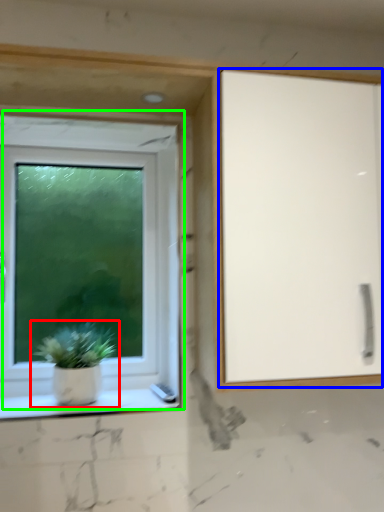
Question: Which is nearer to the houseplant (highlighted by a red box)? screen door (highlighted by a blue box) or window (highlighted by a green box).

Choices:
 (A) screen door
 (B) window

Answer: (B)